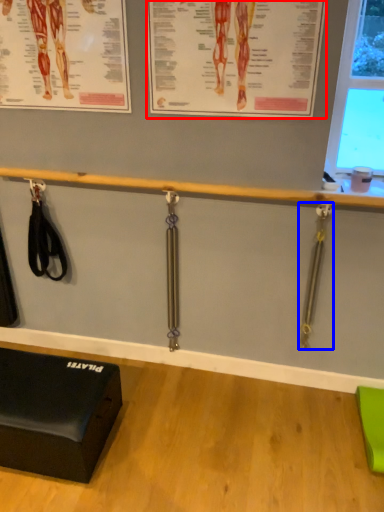
Question: Which object appears farthest to the camera in this image, poster page (highlighted by a red box) or weight (highlighted by a blue box)?

Choices:
 (A) poster page
 (B) weight

Answer: (B)